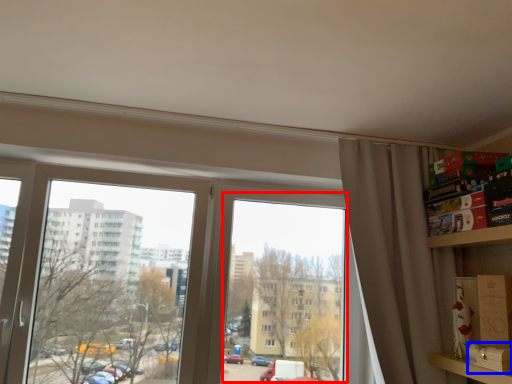
Question: Which object appears farthest to the camera in this image, window screen (highlighted by a red box) or cardboard box (highlighted by a blue box)?

Choices:
 (A) window screen
 (B) cardboard box

Answer: (A)